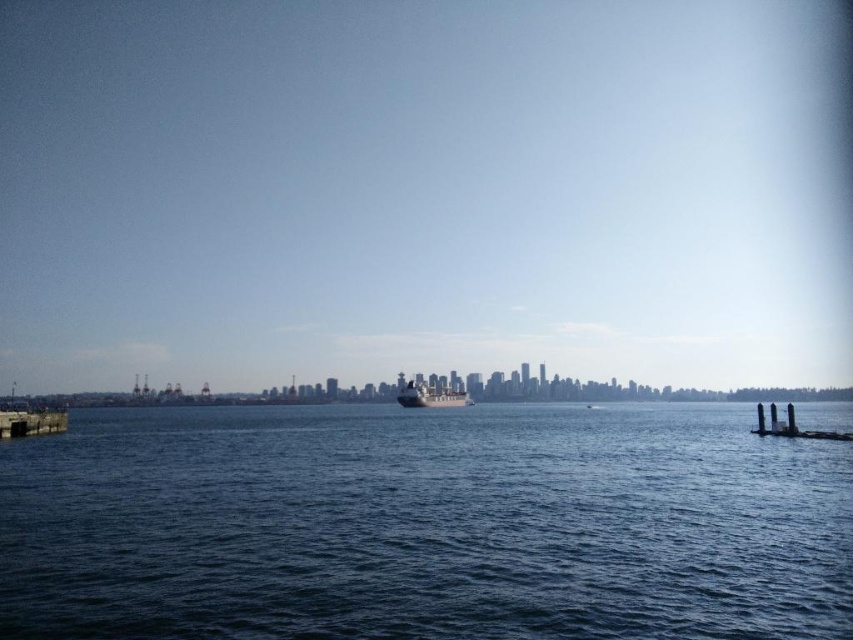
Is blue water at center wider than metallic gray ship at center?

Yes, blue water at center is wider than metallic gray ship at center.

Looking at this image, is blue water at center smaller than metallic gray ship at center?

No.

Measure the distance between point (202, 454) and camera.

The distance of point (202, 454) from camera is 52.64 meters.

Find the location of `blue water at center`. blue water at center is located at coordinates (424, 525).

Is concrete pier at lower left taller than smooth concrete pillars at lower right?

No, concrete pier at lower left is not taller than smooth concrete pillars at lower right.

Is concrete pier at lower left smaller than smooth concrete pillars at lower right?

Indeed, concrete pier at lower left has a smaller size compared to smooth concrete pillars at lower right.

Is point (62, 424) less distant than point (801, 433)?

No.

Where is `concrete pier at lower left`? concrete pier at lower left is located at coordinates (32, 422).

Is point (402, 400) positioned after point (770, 413)?

Yes.

How distant is metallic gray ship at center from smooth concrete pillars at lower right?

A distance of 151.79 meters exists between metallic gray ship at center and smooth concrete pillars at lower right.

Looking at this image, who is more distant from viewer, (422, 401) or (787, 404)?

Point (422, 401)

The width and height of the screenshot is (853, 640). Identify the location of metallic gray ship at center. (428, 394).